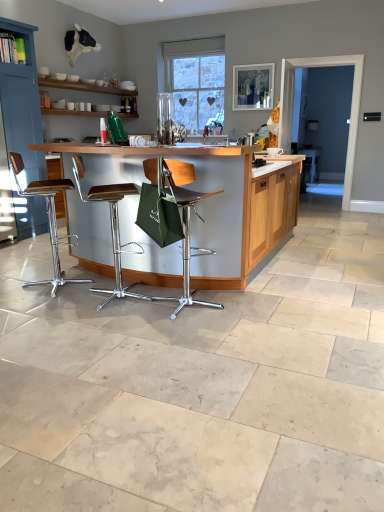
At what (x,y) coordinates should I click in order to perform the action: click on blue painted wood cabinet at left. Please return your answer as a coordinate pair (x, y). The image size is (384, 512). Looking at the image, I should click on (22, 102).

What do you see at coordinates (351, 106) in the screenshot? Image resolution: width=384 pixels, height=512 pixels. I see `transparent glass door at right` at bounding box center [351, 106].

You are a GUI agent. You are given a task and a screenshot of the screen. Output one action in this format:
    pyautogui.click(x=<x>, y=<y>)
    Task: Click on the blue painted wood cabinet at left
    
    Given the screenshot: What is the action you would take?
    pyautogui.click(x=22, y=102)

Would you say wooden table at center is inside or outside transparent glass door at right?

wooden table at center is spatially situated outside transparent glass door at right.

Considering the positions of objects wooden table at center and transparent glass door at right in the image provided, who is more to the right, wooden table at center or transparent glass door at right?

transparent glass door at right.

Is wooden table at center looking in the opposite direction of transparent glass door at right?

No, wooden table at center is not facing the opposite direction of transparent glass door at right.

This screenshot has height=512, width=384. What are the coordinates of `table that is under the transparent glass door at right (from a real-world perspective)` in the screenshot? It's located at (211, 202).

Relative to blue painted wood cabinet at left, is green fabric chair at center, the 3th chair in the left-to-right sequence, in front or behind?

In the image, green fabric chair at center, the 3th chair in the left-to-right sequence, appears in front of blue painted wood cabinet at left.

From the image's perspective, is green fabric chair at center, the 3th chair in the left-to-right sequence, on blue painted wood cabinet at left?

No, from the image's perspective, green fabric chair at center, the 3th chair in the left-to-right sequence, is not above blue painted wood cabinet at left.

How different are the orientations of green fabric chair at center, the first chair positioned from the right, and blue painted wood cabinet at left in degrees?

The facing directions of green fabric chair at center, the first chair positioned from the right, and blue painted wood cabinet at left are 80 degrees apart.

Which of these two, green fabric chair at center, the 3th chair in the left-to-right sequence, or blue painted wood cabinet at left, is smaller?

With smaller size is green fabric chair at center, the 3th chair in the left-to-right sequence.

From a real-world perspective, who is located higher, wooden table at center or blue painted wood cabinet at left?

From a 3D spatial view, blue painted wood cabinet at left is above.

Which of these two, wooden table at center or blue painted wood cabinet at left, stands shorter?

wooden table at center is shorter.

In the scene shown: Is wooden table at center beside blue painted wood cabinet at left?

No.

From the image's perspective, who appears lower, wooden table at center or blue painted wood cabinet at left?

wooden table at center.

Can you confirm if transparent glass door at right is positioned to the left of metallic brown stool at center, acting as the 2th chair starting from the left?

No, transparent glass door at right is not to the left of metallic brown stool at center, acting as the 2th chair starting from the left.

Based on their sizes in the image, would you say transparent glass door at right is bigger or smaller than metallic brown stool at center, acting as the 2th chair starting from the left?

Clearly, transparent glass door at right is larger in size than metallic brown stool at center, acting as the 2th chair starting from the left.

Are transparent glass door at right and metallic brown stool at center, acting as the 2th chair starting from the left, located far from each other?

Yes, transparent glass door at right and metallic brown stool at center, acting as the 2th chair starting from the left, are quite far apart.

Based on the photo, which object is further away from the camera taking this photo, transparent glass door at right or metallic brown stool at center, placed as the second chair when sorted from right to left?

Positioned behind is transparent glass door at right.

Is metallic brown stool at left, the 1th chair from the left, to the left of blue painted wood cabinet at left from the viewer's perspective?

In fact, metallic brown stool at left, the 1th chair from the left, is to the right of blue painted wood cabinet at left.

Is there a large distance between metallic brown stool at left, marked as the third chair in a right-to-left arrangement, and blue painted wood cabinet at left?

Yes, metallic brown stool at left, marked as the third chair in a right-to-left arrangement, and blue painted wood cabinet at left are quite far apart.

Between metallic brown stool at left, the 1th chair from the left, and blue painted wood cabinet at left, which one has smaller width?

metallic brown stool at left, the 1th chair from the left.

Are transparent glass door at right and blue painted wood cabinet at left making contact?

No, transparent glass door at right is not in contact with blue painted wood cabinet at left.

Is blue painted wood cabinet at left at the back of transparent glass door at right?

No, transparent glass door at right is not facing the opposite direction of blue painted wood cabinet at left.

Based on the photo, from a real-world perspective, between transparent glass door at right and blue painted wood cabinet at left, who is vertically lower?

In real-world perspective, transparent glass door at right is lower.

The image size is (384, 512). In order to click on glass door lying behind the blue painted wood cabinet at left in this screenshot , I will do `click(351, 106)`.

Is blue painted wood cabinet at left taller or shorter than transparent glass door at right?

In the image, blue painted wood cabinet at left appears to be shorter than transparent glass door at right.

Which object is wider, blue painted wood cabinet at left or transparent glass door at right?

With larger width is blue painted wood cabinet at left.

Does blue painted wood cabinet at left come behind transparent glass door at right?

No, it is not.

Is transparent glass door at right a part of blue painted wood cabinet at left?

No.

Find the location of a particular element. This screenshot has height=512, width=384. glass door that is above the wooden table at center (from a real-world perspective) is located at coordinates 351,106.

Find the location of a particular element. This screenshot has height=512, width=384. cabinetry on the left of green fabric chair at center, the 3th chair in the left-to-right sequence is located at coordinates [x=22, y=102].

Looking at this image, based on their spatial positions, is green fabric chair at center, the first chair positioned from the right, or metallic brown stool at center, placed as the second chair when sorted from right to left, further from transparent glass door at right?

metallic brown stool at center, placed as the second chair when sorted from right to left.

Based on their spatial positions, is transparent glass door at right or metallic brown stool at center, acting as the 2th chair starting from the left, closer to green fabric chair at center, the first chair positioned from the right?

Among the two, metallic brown stool at center, acting as the 2th chair starting from the left, is located nearer to green fabric chair at center, the first chair positioned from the right.

Considering their positions, is blue painted wood cabinet at left positioned closer to wooden table at center than metallic brown stool at left, the 1th chair from the left?

metallic brown stool at left, the 1th chair from the left, lies closer to wooden table at center than the other object.

Estimate the real-world distances between objects in this image. Which object is closer to green fabric chair at center, the 3th chair in the left-to-right sequence, blue painted wood cabinet at left or metallic brown stool at left, the 1th chair from the left?

metallic brown stool at left, the 1th chair from the left, lies closer to green fabric chair at center, the 3th chair in the left-to-right sequence, than the other object.

Looking at the image, which one is located closer to wooden table at center, metallic brown stool at left, marked as the third chair in a right-to-left arrangement, or green fabric chair at center, the 3th chair in the left-to-right sequence?

The object closer to wooden table at center is green fabric chair at center, the 3th chair in the left-to-right sequence.

Which object lies nearer to the anchor point wooden table at center, transparent glass door at right or metallic brown stool at left, marked as the third chair in a right-to-left arrangement?

metallic brown stool at left, marked as the third chair in a right-to-left arrangement.

Looking at the image, which one is located further to metallic brown stool at center, acting as the 2th chair starting from the left, wooden table at center or green fabric chair at center, the 3th chair in the left-to-right sequence?

wooden table at center.

Considering their positions, is wooden table at center positioned closer to green fabric chair at center, the 3th chair in the left-to-right sequence, than metallic brown stool at left, the 1th chair from the left?

wooden table at center lies closer to green fabric chair at center, the 3th chair in the left-to-right sequence, than the other object.

Find the location of a particular element. This screenshot has width=384, height=512. chair between metallic brown stool at center, acting as the 2th chair starting from the left, and transparent glass door at right from front to back is located at coordinates (48, 218).

The height and width of the screenshot is (512, 384). In order to click on table between blue painted wood cabinet at left and transparent glass door at right in this screenshot , I will do `click(211, 202)`.

Image resolution: width=384 pixels, height=512 pixels. What are the coordinates of `chair between metallic brown stool at center, acting as the 2th chair starting from the left, and wooden table at center from left to right` in the screenshot? It's located at (185, 224).

Locate an element on the screen. Image resolution: width=384 pixels, height=512 pixels. chair between blue painted wood cabinet at left and metallic brown stool at center, acting as the 2th chair starting from the left is located at coordinates (48, 218).